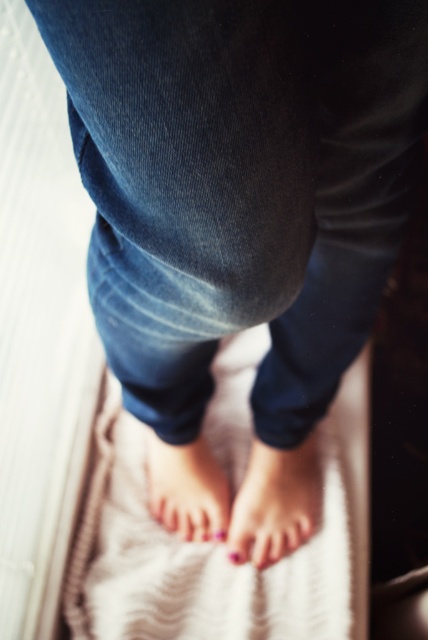
Question: Is nail-polished skin at lower center to the left of pink polished toenails at lower center from the viewer's perspective?

Choices:
 (A) no
 (B) yes

Answer: (A)

Question: Which of the following is the closest to the observer?

Choices:
 (A) (238, 563)
 (B) (315, 467)
 (C) (104, 611)
 (D) (226, 532)

Answer: (C)

Question: Can you confirm if textured beige mat at center is bigger than nail-polished skin at lower center?

Choices:
 (A) yes
 (B) no

Answer: (A)

Question: Which object is closer to the camera taking this photo?

Choices:
 (A) pink matte toe at center
 (B) pink polished toenails at lower center
 (C) nail-polished skin at lower center
 (D) textured beige mat at center

Answer: (D)

Question: Which object is positioned closest to the nail-polished skin at lower center?

Choices:
 (A) pink matte toe at center
 (B) pink polished toenails at lower center
 (C) textured beige mat at center

Answer: (B)

Question: Considering the relative positions of nail-polished skin at lower center and pink matte toe at center in the image provided, where is nail-polished skin at lower center located with respect to pink matte toe at center?

Choices:
 (A) right
 (B) left

Answer: (A)